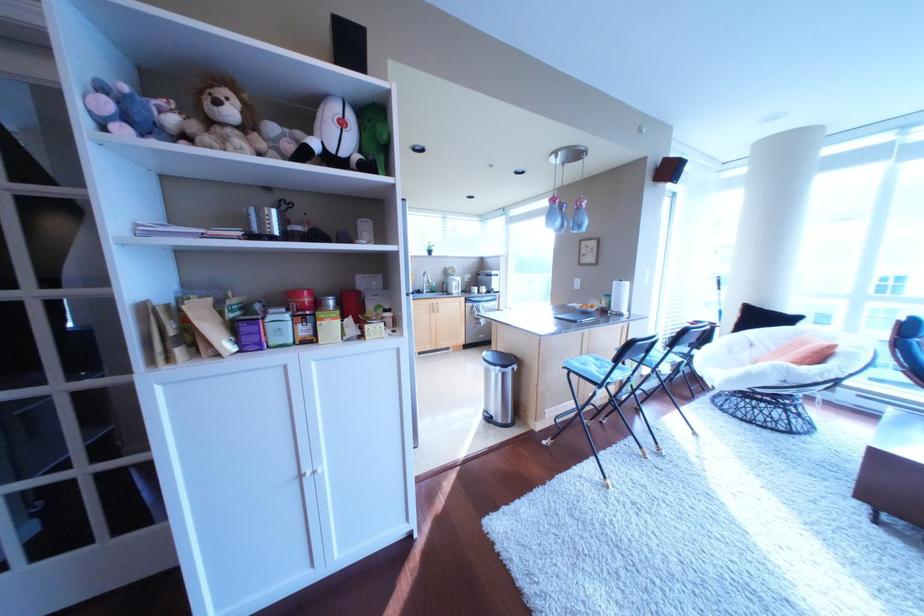
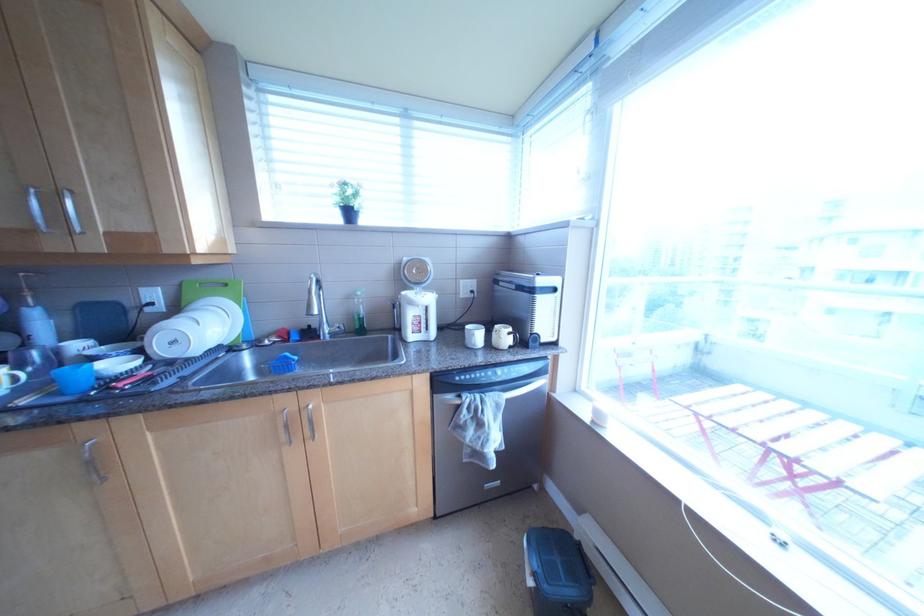
Question: The images are taken continuously from a first-person perspective. In which direction are you moving?

Choices:
 (A) Left
 (B) Right
 (C) Forward
 (D) Backward

Answer: (C)